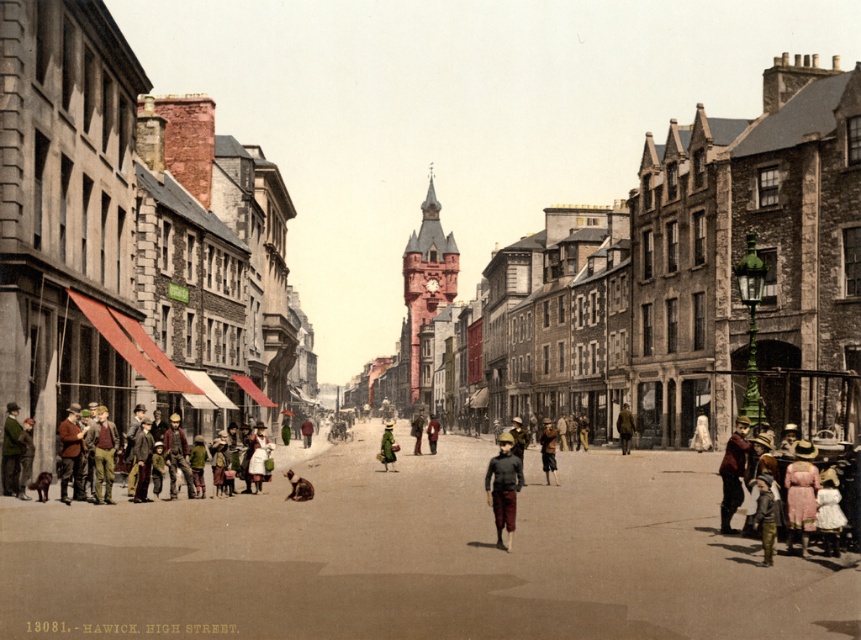
Between matte stone buildings at left and khaki fabric jacket at center, which one appears on the right side from the viewer's perspective?

khaki fabric jacket at center

How far apart are matte stone buildings at left and khaki fabric jacket at center?

matte stone buildings at left is 321.53 meters away from khaki fabric jacket at center.

Does point (318, 141) come farther from viewer compared to point (621, 452)?

That is True.

Where is `matte stone buildings at left`? matte stone buildings at left is located at coordinates (455, 115).

The image size is (861, 640). I want to click on matte brown pants at center, so click(x=503, y=486).

Does matte brown pants at center have a lesser height compared to light brown fabric dress at center?

Indeed, matte brown pants at center has a lesser height compared to light brown fabric dress at center.

The height and width of the screenshot is (640, 861). I want to click on matte brown pants at center, so click(x=503, y=486).

Where is `matte brown pants at center`? The image size is (861, 640). matte brown pants at center is located at coordinates [503, 486].

Can you confirm if matte stone buildings at left is positioned to the left of matte brown pants at center?

No, matte stone buildings at left is not to the left of matte brown pants at center.

Find the location of a particular element. matte stone buildings at left is located at coordinates (455, 115).